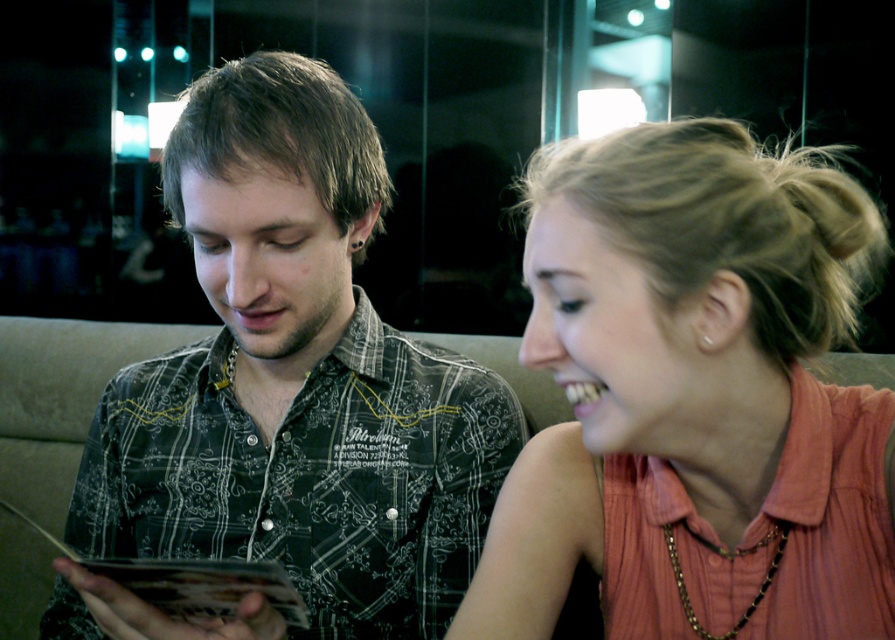
You are a fashion designer observing two people in the scene. You need to determine which clothing item, the matte coral blouse at center or the black printed shirt at center, is shorter in length. Which one is shorter?

The matte coral blouse at center has a lesser height compared to the black printed shirt at center, so the matte coral blouse at center is shorter in length.

You are standing at point (621,512). You want to move to the person on the right. Can you reach them without moving past the person on the left?

The distance between you and the person on the right is 74.40 centimeters. Since you are starting at point (621,512), you can move towards them without needing to pass the person on the left as they are not in your path.

You are a photographer setting up for a group photo. You notice the matte coral blouse at center and the black printed shirt at center. Which one should you adjust to ensure both are centered in the frame?

The matte coral blouse at center is to the right of the black printed shirt at center, so you should move the matte coral blouse at center slightly to the left to align both items centrally in the frame.